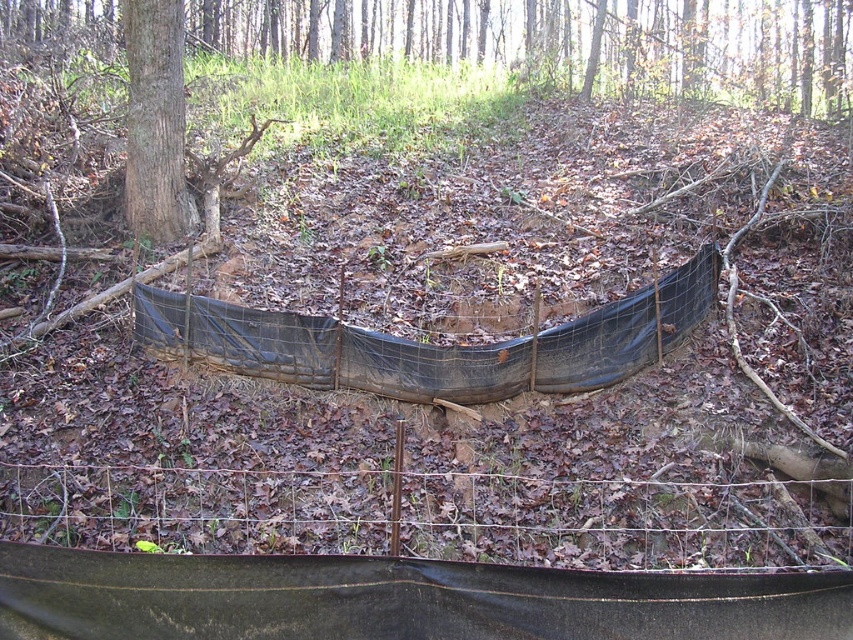
Question: Among these objects, which one is farthest from the camera?

Choices:
 (A) wire mesh fence at lower center
 (B) brown rough bark tree at center-left

Answer: (B)

Question: Is brown wood tree at upper center positioned at the back of black plastic tarp at center?

Choices:
 (A) no
 (B) yes

Answer: (B)

Question: Which object is farther from the camera taking this photo?

Choices:
 (A) brown rough bark tree at center-left
 (B) brown wood tree at upper center
 (C) black plastic tarp at center

Answer: (B)

Question: Which point appears farthest from the camera in this image?

Choices:
 (A) click(x=177, y=60)
 (B) click(x=769, y=509)
 (C) click(x=461, y=42)
 (D) click(x=287, y=369)

Answer: (C)

Question: Where is wire mesh fence at lower center located in relation to black plastic tarp at center in the image?

Choices:
 (A) above
 (B) below

Answer: (B)

Question: Can you confirm if wire mesh fence at lower center is positioned below black plastic tarp at center?

Choices:
 (A) no
 (B) yes

Answer: (B)